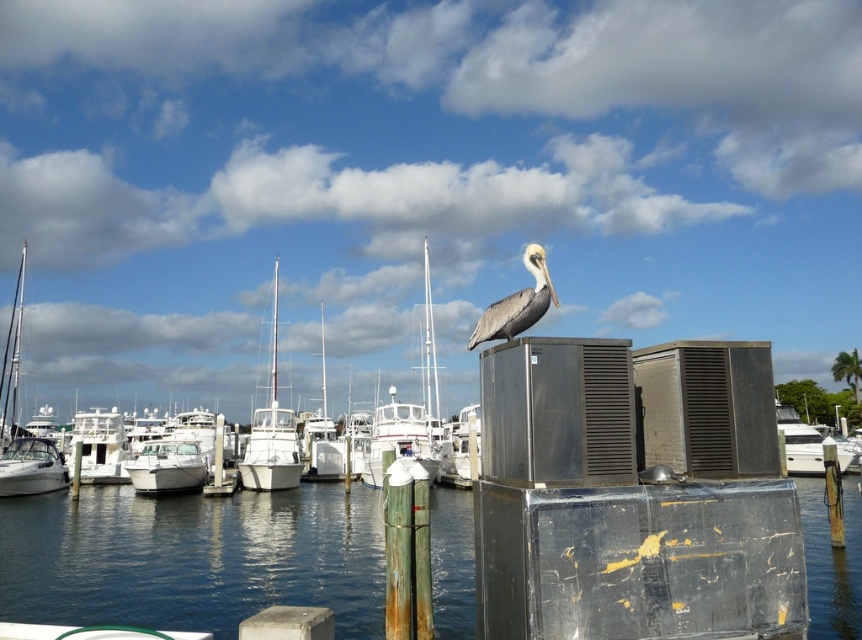
You are a photographer positioned at the origin point of the coordinate system in the image. You want to capture the white glossy sailboat at center in your shot. What are the coordinates where you should aim your camera?

The white glossy sailboat at center is located at coordinates point (272, 433), so you should aim your camera at those coordinates to capture it.

Consider the image. You are a photographer trying to capture the brown feathered pelican at center and the clear blue water at center in a single shot. Which object should you focus on first to ensure it appears larger in your photo?

The clear blue water at center is taller than the brown feathered pelican at center, so focusing on the clear blue water at center first will ensure it appears larger in the photo.